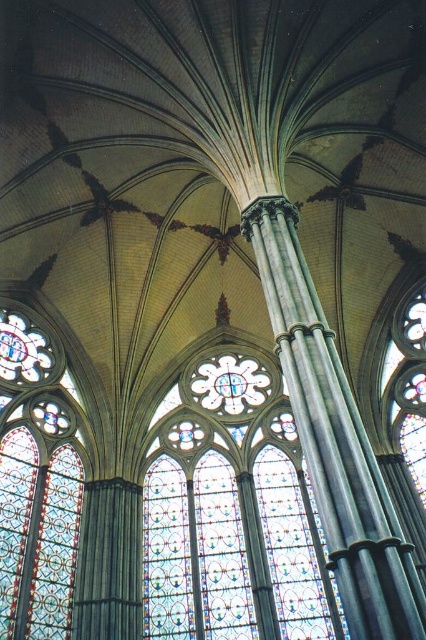
You are standing in the cathedral and want to take a photo of the stained glass window at left. To avoid blocking the polished stone column at center in your shot, which direction should you move?

The polished stone column at center is to the right of the stained glass window at left. To avoid blocking the column, move to the left side of the window so the column is out of frame.